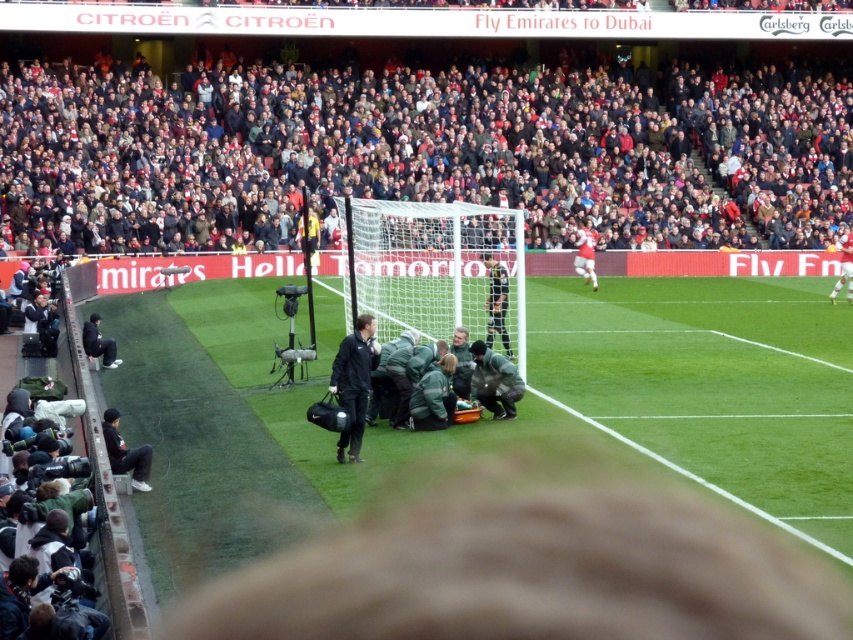
Question: Does dark gray crowd at upper center have a larger size compared to white net at center?

Choices:
 (A) no
 (B) yes

Answer: (B)

Question: Which is farther from the red jersey at upper right?

Choices:
 (A) green fabric medical team at center
 (B) green grass football field at center
 (C) dark gray crowd at upper center
 (D) black matte jacket at center

Answer: (A)

Question: Is green grass football field at center wider than green fabric medical team at center?

Choices:
 (A) no
 (B) yes

Answer: (B)

Question: Which object is closer to the camera taking this photo?

Choices:
 (A) black matte jacket at center
 (B) white net at center

Answer: (A)

Question: Which of these objects is positioned farthest from the red jersey at upper right?

Choices:
 (A) green fabric medical team at center
 (B) green grass football field at center
 (C) dark gray crowd at upper center
 (D) black matte jacket at center

Answer: (A)

Question: Does black matte jacket at center have a smaller size compared to red jersey at upper right?

Choices:
 (A) yes
 (B) no

Answer: (A)